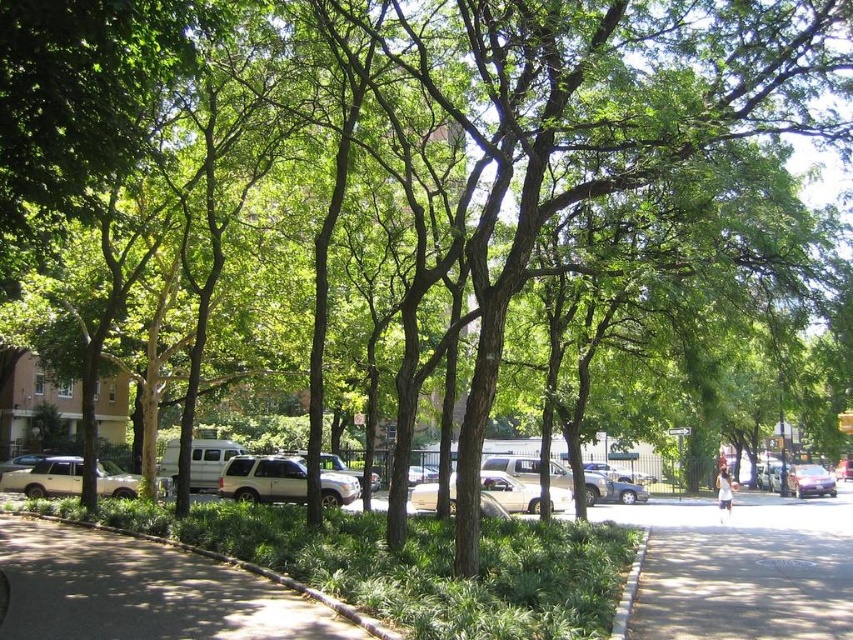
You are a gardener who needs to mow the lawn. You see the green grass at lower left and the matte silver suv at lower left. Which one is closer to the ground?

The green grass at lower left is shorter than the matte silver suv at lower left, so the green grass at lower left is closer to the ground.